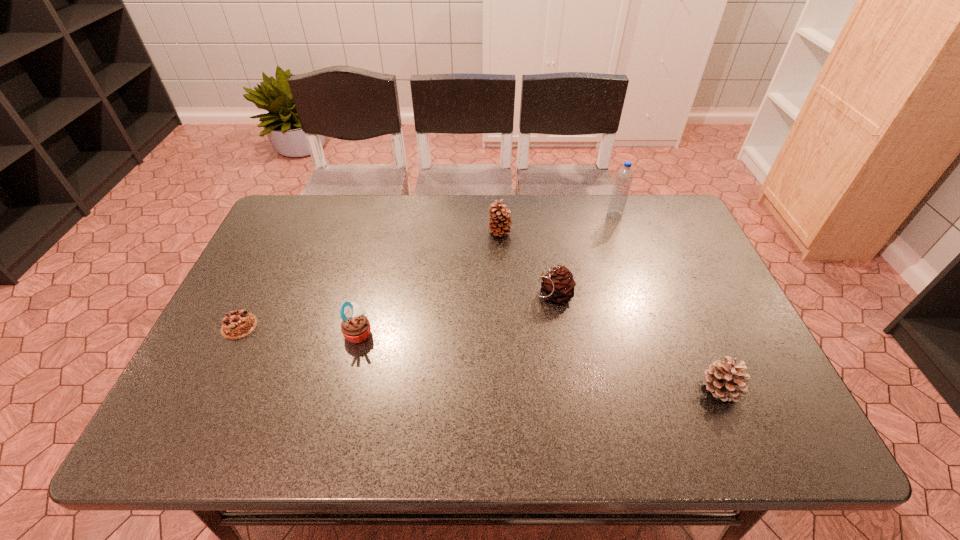
Where is `vacant space that's between the chocolate cake and the water bottle`? This screenshot has height=540, width=960. vacant space that's between the chocolate cake and the water bottle is located at coordinates (427, 271).

At what (x,y) coordinates should I click in order to perform the action: click on free spot between the rightmost pinecone and the leftmost pinecone. Please return your answer as a coordinate pair (x, y). This screenshot has width=960, height=540. Looking at the image, I should click on (611, 310).

Locate an element on the screen. unoccupied position between the rightmost object and the water bottle is located at coordinates (668, 302).

You are a GUI agent. You are given a task and a screenshot of the screen. Output one action in this format:
    pyautogui.click(x=<x>, y=<y>)
    Task: Click on the free space between the tallest object and the second object from left to right
    This screenshot has height=540, width=960.
    Given the screenshot: What is the action you would take?
    pos(487,274)

You are a GUI agent. You are given a task and a screenshot of the screen. Output one action in this format:
    pyautogui.click(x=<x>, y=<y>)
    Task: Click on the vacant area that lies between the shortest object and the third object from left to right
    The image size is (960, 540).
    Given the screenshot: What is the action you would take?
    pyautogui.click(x=370, y=279)

The width and height of the screenshot is (960, 540). I want to click on free space between the shortest object and the rightmost pinecone, so tap(480, 357).

Locate an element on the screen. The image size is (960, 540). free space that is in between the muffin and the water bottle is located at coordinates (487, 274).

Find the location of a particular element. This screenshot has height=540, width=960. free spot between the second nearest pinecone and the leftmost object is located at coordinates (396, 310).

The image size is (960, 540). Find the location of `vacant space that is in between the nearest pinecone and the second object from right to left`. vacant space that is in between the nearest pinecone and the second object from right to left is located at coordinates (668, 302).

I want to click on empty location between the second farthest object and the fourth nearest object, so click(526, 263).